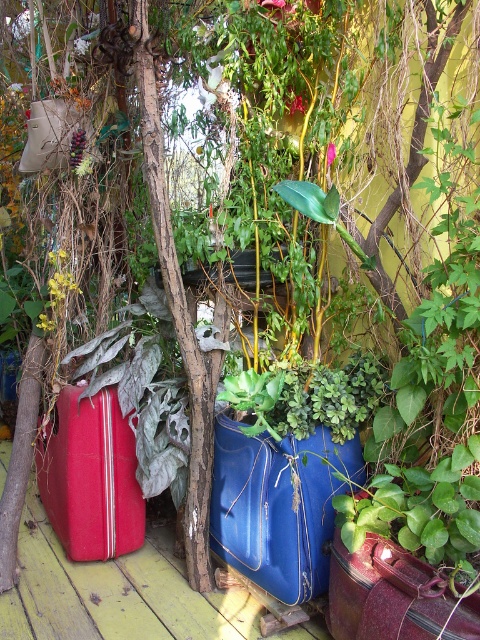
You are standing on the wooden deck and want to take a photo of both the point at coordinates point (x=302, y=634) and point (x=57, y=419). Which point should you focus on first to ensure both are in focus?

Point point (x=302, y=634) is closer to the camera than point (x=57, y=419), so focus on point point (x=302, y=634) first to ensure both are in focus.

You are a gardener who wants to water the plants in the glossy blue suitcase at center and the rusty metallic suitcase at center. Which one should you water first if you want to start from the top?

The glossy blue suitcase at center is above the rusty metallic suitcase at center, so you should water the glossy blue suitcase at center first.